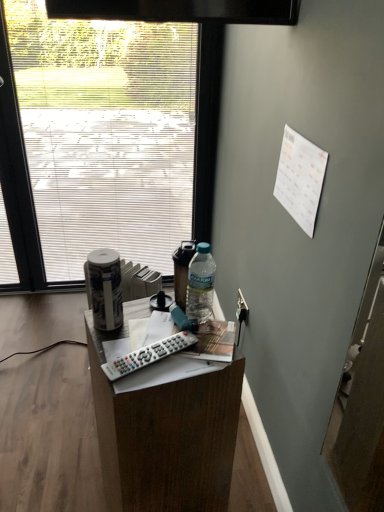
Question: Does white glossy canister at left have a lesser width compared to frosted glass window at upper left?

Choices:
 (A) no
 (B) yes

Answer: (B)

Question: Is white glossy canister at left oriented away from frosted glass window at upper left?

Choices:
 (A) yes
 (B) no

Answer: (B)

Question: Considering the relative sizes of white glossy canister at left and frosted glass window at upper left in the image provided, is white glossy canister at left bigger than frosted glass window at upper left?

Choices:
 (A) yes
 (B) no

Answer: (B)

Question: From the image's perspective, would you say white glossy canister at left is shown under frosted glass window at upper left?

Choices:
 (A) yes
 (B) no

Answer: (A)

Question: From the image's perspective, is white glossy canister at left located above frosted glass window at upper left?

Choices:
 (A) yes
 (B) no

Answer: (B)

Question: Considering their positions, is white glossy canister at left located in front of or behind black plastic power outlet at lower right?

Choices:
 (A) behind
 (B) front

Answer: (B)

Question: Considering the positions of white glossy canister at left and black plastic power outlet at lower right in the image, is white glossy canister at left taller or shorter than black plastic power outlet at lower right?

Choices:
 (A) tall
 (B) short

Answer: (A)

Question: Is white glossy canister at left inside or outside of black plastic power outlet at lower right?

Choices:
 (A) inside
 (B) outside

Answer: (B)

Question: Visually, is white glossy canister at left positioned to the left or to the right of black plastic power outlet at lower right?

Choices:
 (A) left
 (B) right

Answer: (A)

Question: In the image, is white glossy canister at left on the left side or the right side of wooden desk at center?

Choices:
 (A) left
 (B) right

Answer: (A)

Question: From a real-world perspective, relative to wooden desk at center, is white glossy canister at left vertically above or below?

Choices:
 (A) above
 (B) below

Answer: (A)

Question: Considering their positions, is white glossy canister at left located in front of or behind wooden desk at center?

Choices:
 (A) behind
 (B) front

Answer: (A)

Question: In terms of size, does white glossy canister at left appear bigger or smaller than wooden desk at center?

Choices:
 (A) small
 (B) big

Answer: (A)

Question: In terms of size, does black plastic power outlet at lower right appear bigger or smaller than wooden desk at center?

Choices:
 (A) big
 (B) small

Answer: (B)

Question: From a real-world perspective, is black plastic power outlet at lower right above or below wooden desk at center?

Choices:
 (A) below
 (B) above

Answer: (A)